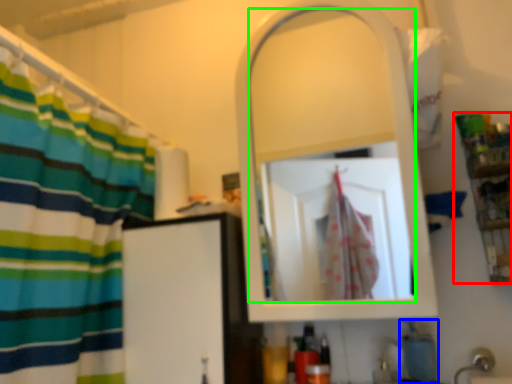
Question: Which is farther away from shelf (highlighted by a red box)? soap (highlighted by a blue box) or mirror (highlighted by a green box)?

Choices:
 (A) soap
 (B) mirror

Answer: (B)